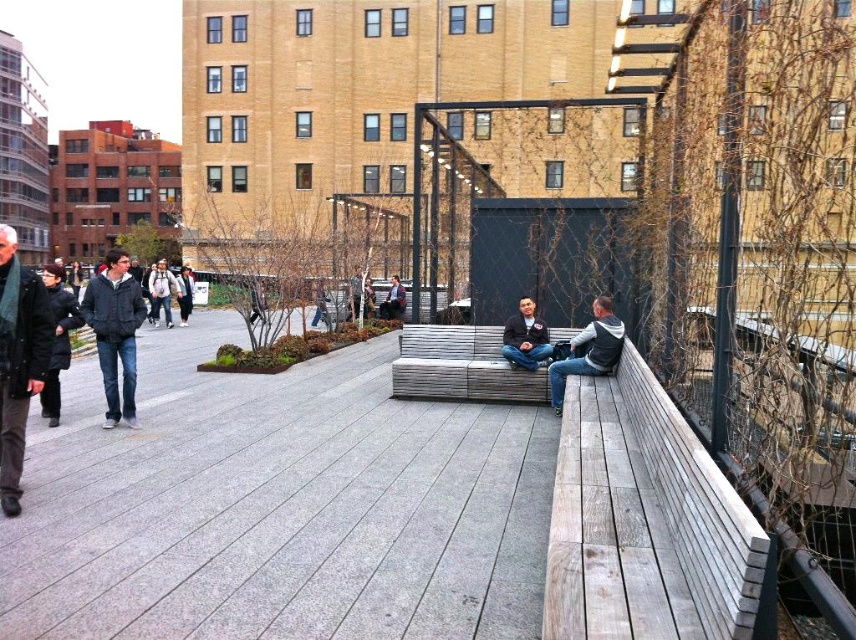
You are standing on the rooftop park and want to find the dark gray jacket at left and the black wool coat at left. According to the scene, which one is lower in position?

The dark gray jacket at left is located below black wool coat at left, so the dark gray jacket at left is lower in position.

You are a photographer trying to capture both the gray fabric jacket at right and the dark blue jacket at center in a single frame. Given that your camera has a fixed focal length and you can only adjust your distance from the subjects, which jacket should you move closer to in order to include both in the frame without cropping?

Since the gray fabric jacket at right is wider than the dark blue jacket at center, you should move closer to the gray fabric jacket at right to ensure both fit within the frame.